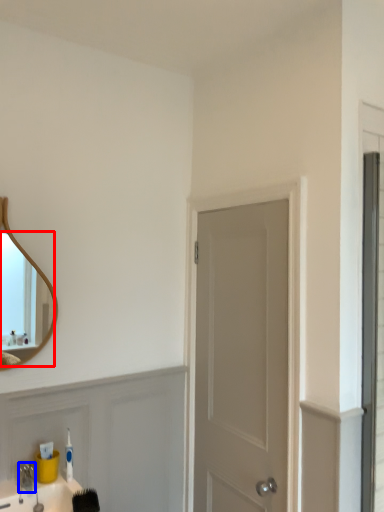
Question: Which point is further to the camera, mirror (highlighted by a red box) or faucet (highlighted by a blue box)?

Choices:
 (A) mirror
 (B) faucet

Answer: (A)